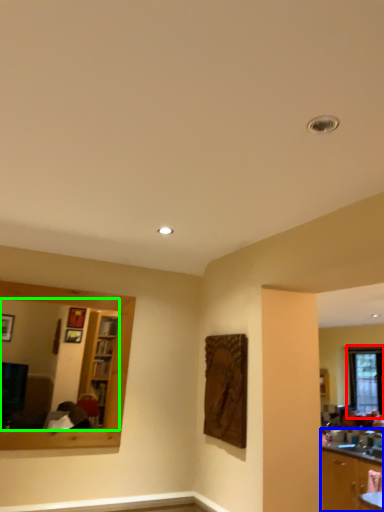
Question: Which object is positioned farthest from window (highlighted by a red box)? Select from cabinetry (highlighted by a blue box) and mirror (highlighted by a green box).

Choices:
 (A) cabinetry
 (B) mirror

Answer: (B)